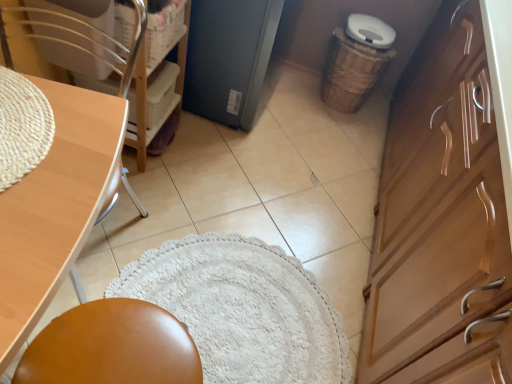
Where is `vacant space in front of woven brown basket at right, which is counted as the 2th basket, starting from the front`? This screenshot has width=512, height=384. vacant space in front of woven brown basket at right, which is counted as the 2th basket, starting from the front is located at coordinates (333, 128).